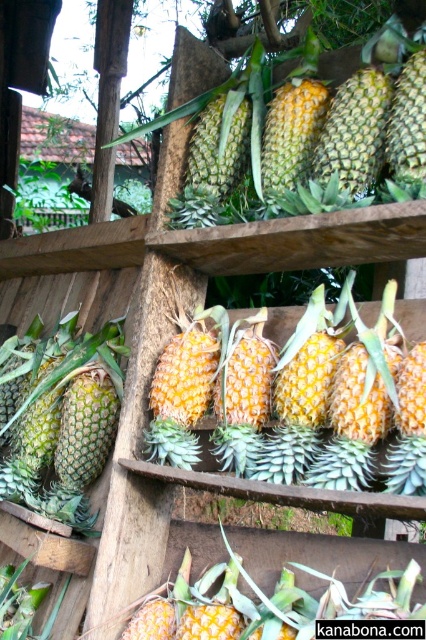
Question: Which of these objects is positioned closest to the yellow matte pineapple at center?

Choices:
 (A) green spiky pineapple at center
 (B) yellow-green spiky pineapple at center-left

Answer: (A)

Question: Among these points, which one is farthest from the camera?

Choices:
 (A) (391, 344)
 (B) (20, 490)
 (C) (414, 196)

Answer: (B)

Question: Is yellow-green spiky pineapple at center-left above green spiky pineapple at center?

Choices:
 (A) no
 (B) yes

Answer: (A)

Question: Is yellow-green spiky pineapple at center-left bigger than green spiky pineapple at center?

Choices:
 (A) no
 (B) yes

Answer: (B)

Question: Estimate the real-world distances between objects in this image. Which object is closer to the yellow matte pineapple at center?

Choices:
 (A) yellow-green spiky pineapple at center-left
 (B) green spiky pineapple at center

Answer: (B)

Question: Is yellow matte pineapple at center further to camera compared to yellow-green spiky pineapple at center-left?

Choices:
 (A) no
 (B) yes

Answer: (A)